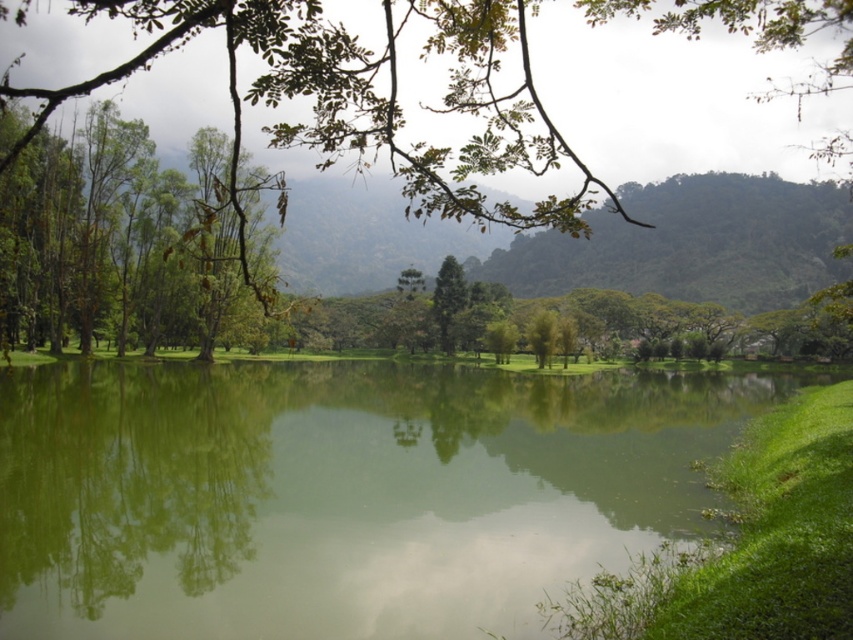
Question: Which point is farther from the camera taking this photo?

Choices:
 (A) (148, 435)
 (B) (442, 300)
 (C) (450, 4)

Answer: (B)

Question: Is green smooth water at center thinner than green leafy tree at upper left?

Choices:
 (A) no
 (B) yes

Answer: (A)

Question: Is green leafy tree at center above green leafy tree at upper left?

Choices:
 (A) no
 (B) yes

Answer: (B)

Question: Which of these objects is positioned farthest from the green matte tree at center?

Choices:
 (A) green leafy tree at upper left
 (B) green smooth water at center

Answer: (B)

Question: Does green smooth water at center appear on the right side of green leafy tree at upper left?

Choices:
 (A) yes
 (B) no

Answer: (A)

Question: Among these objects, which one is farthest from the camera?

Choices:
 (A) green matte tree at center
 (B) green leafy tree at upper left
 (C) green leafy tree at center
 (D) green smooth water at center

Answer: (A)